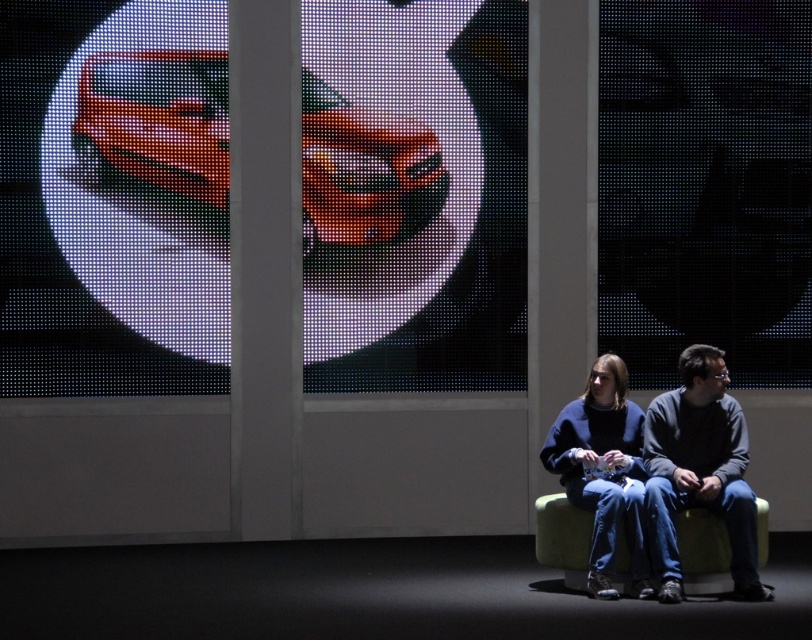
Which is more to the left, dark gray sweater at center right or blue fleece sweater at center?

From the viewer's perspective, blue fleece sweater at center appears more on the left side.

Can you confirm if dark gray sweater at center right is positioned to the right of blue fleece sweater at center?

Correct, you'll find dark gray sweater at center right to the right of blue fleece sweater at center.

Is point (720, 433) in front of point (609, 524)?

No, it is not.

Locate an element on the screen. The image size is (812, 640). dark gray sweater at center right is located at coordinates (698, 472).